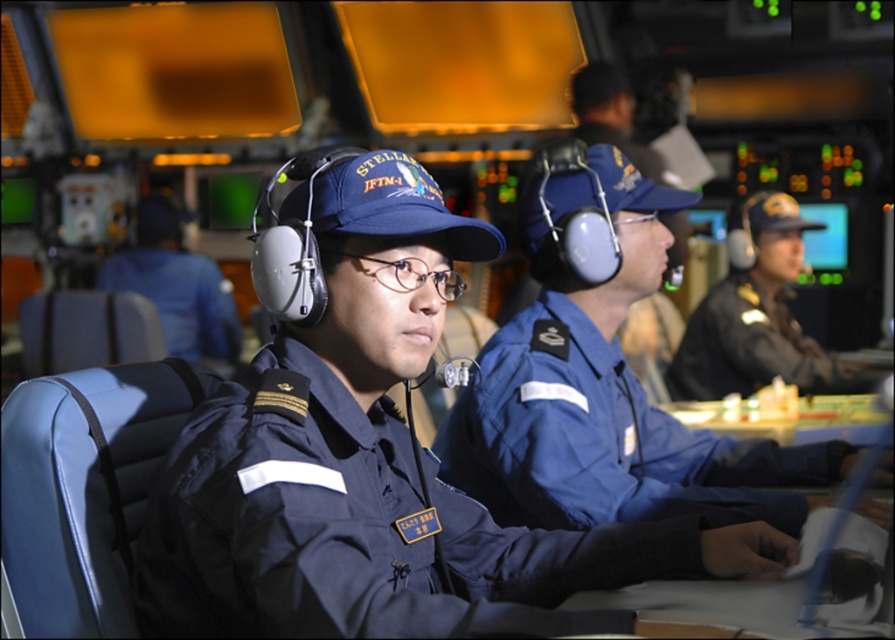
From the picture: You are a new crew member standing 5.5 feet tall. You need to reach a control panel located 6 feet above the floor. Can you reach it while standing on the blue fabric uniform at center?

The blue fabric uniform at center is 6.56 feet away from the viewer, but this distance does not affect your ability to reach the control panel. Your height of 5.5 feet may make it difficult to reach the 6 feet high control panel without assistance.

In the control room scene, there are two uniforms visible. The navy blue uniform at center and the dark blue fabric uniform at right. Which one is positioned to the left?

The navy blue uniform at center is positioned to the left of the dark blue fabric uniform at right.

You are a tailor who needs to determine which uniform requires more fabric to make between the dark blue fabric uniform at right and the blue uniform at center. Based on the scene, which one would need more fabric?

The dark blue fabric uniform at right is bigger than the blue uniform at center, so it would require more fabric to make.